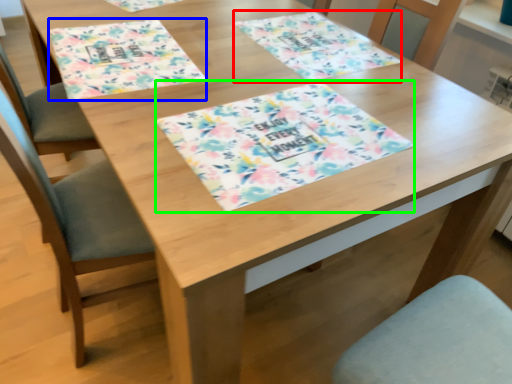
Question: Based on their relative distances, which object is farther from place mat (highlighted by a red box)? Choose from place mat (highlighted by a blue box) and tablecloth (highlighted by a green box).

Choices:
 (A) place mat
 (B) tablecloth

Answer: (A)